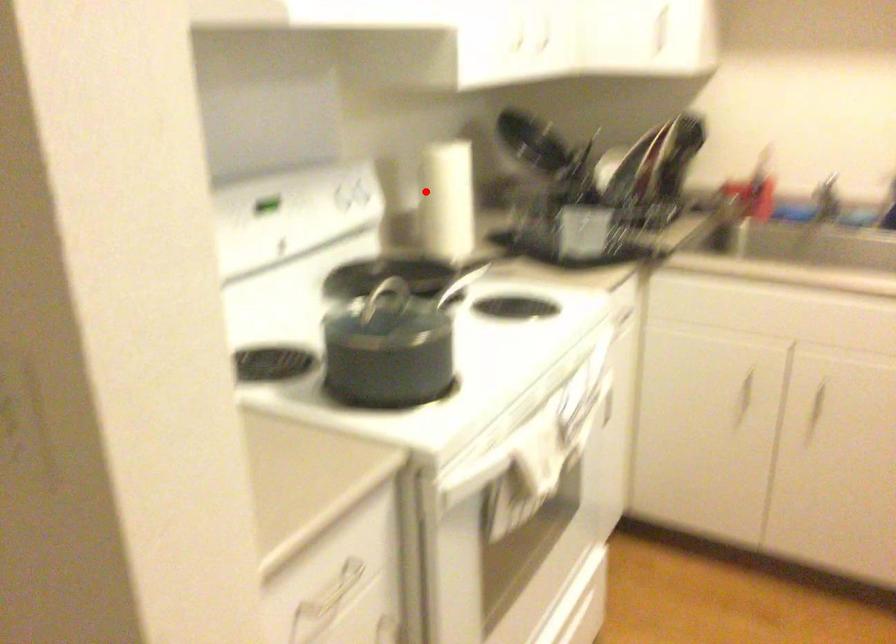
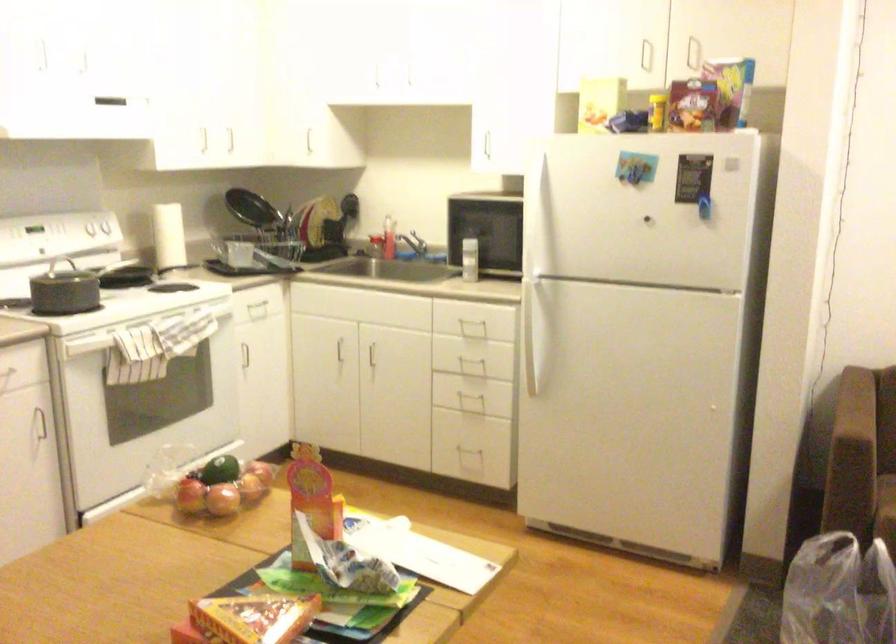
Question: I am providing you with two images of the same scene from different viewpoints. A red point is shown in image1. For the corresponding object point in image2, is it positioned nearer or farther from the camera?

Choices:
 (A) Nearer
 (B) Farther

Answer: (B)